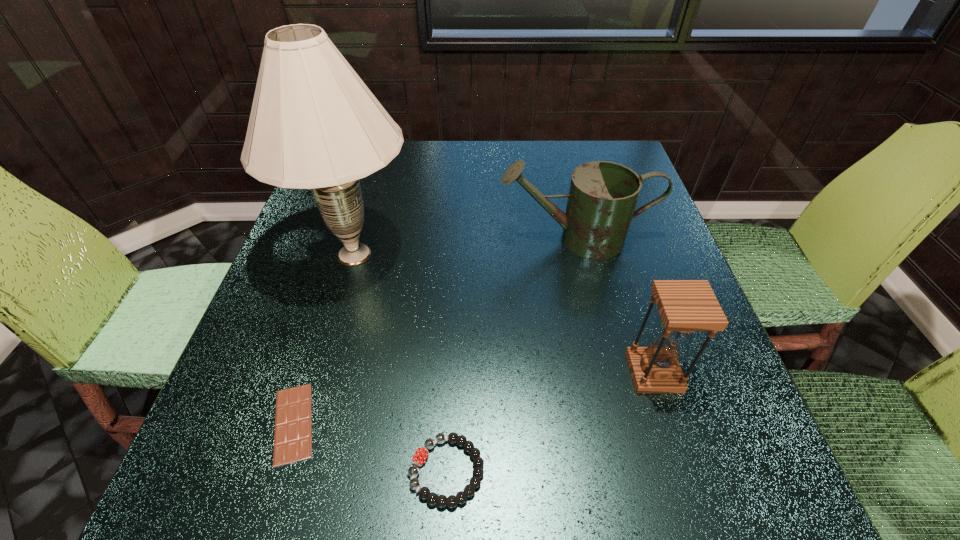
Where is `free space located 0.050m on the left of the hourglass`? This screenshot has height=540, width=960. free space located 0.050m on the left of the hourglass is located at coordinates (602, 373).

Find the location of a particular element. This screenshot has height=540, width=960. free space located on the left of the bracelet is located at coordinates (316, 471).

Locate an element on the screen. This screenshot has height=540, width=960. free space located 0.240m on the back of the shortest object is located at coordinates (337, 284).

The height and width of the screenshot is (540, 960). In order to click on bracelet located in the near edge section of the desktop in this screenshot , I will do `click(421, 454)`.

Where is `chocolate bar situated at the near edge`? chocolate bar situated at the near edge is located at coordinates (293, 421).

Identify the location of lampshade present at the left edge. The height and width of the screenshot is (540, 960). (314, 124).

Where is `chocolate bar positioned at the left edge`? This screenshot has height=540, width=960. chocolate bar positioned at the left edge is located at coordinates (293, 421).

Image resolution: width=960 pixels, height=540 pixels. Find the location of `watering can present at the right edge`. watering can present at the right edge is located at coordinates (602, 198).

Find the location of a particular element. hourglass located at the right edge is located at coordinates (685, 306).

Where is `object present at the near left corner`? Image resolution: width=960 pixels, height=540 pixels. object present at the near left corner is located at coordinates (293, 421).